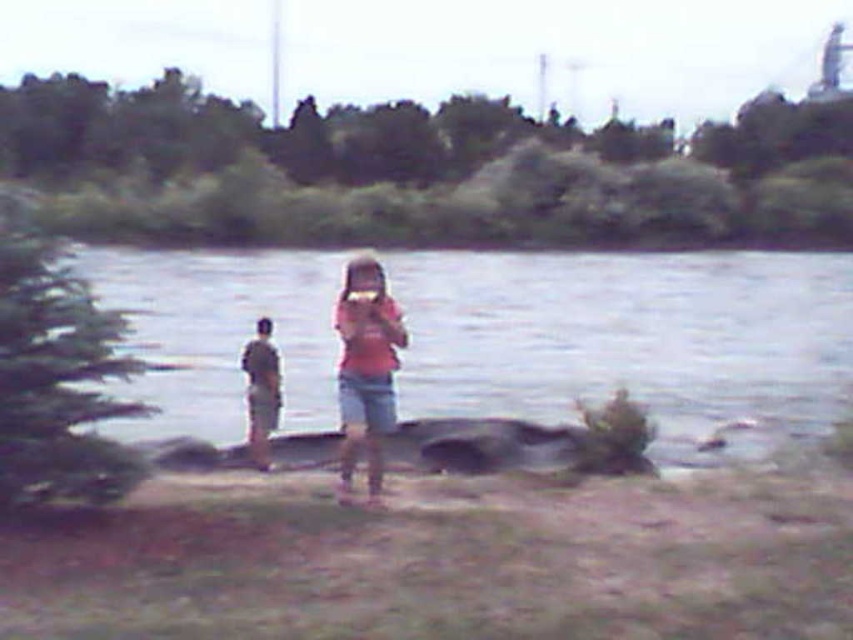
You are a photographer standing on the muddy ground near the water. You want to place your camera on a stable surface between the gray smooth rock at center and the light brown wooden stick at left. Which object should you choose and why?

The gray smooth rock at center is to the left of the light brown wooden stick at left. Since the rock is smooth and likely more stable than the wooden stick, you should place your camera on the gray smooth rock at center.

You are a photographer standing at the water edge. You want to take a photo of the gray smooth rock at center and the pink matte shirt at center. If your camera has a maximum focus range of 50 feet, will you be able to capture both subjects clearly in the same frame?

The gray smooth rock at center is 51.10 feet away from the pink matte shirt at center. Since the camera can only focus up to 50 feet, the distance between them exceeds the maximum focus range. Therefore, you won cannot capture both subjects clearly in the same frame.

From the picture: You are trying to decide whether to place your camera on the gray smooth rock at center or the pink matte shirt at center. Which surface is more stable for placing your camera?

The gray smooth rock at center is larger in size than the pink matte shirt at center, so it is more stable for placing the camera.